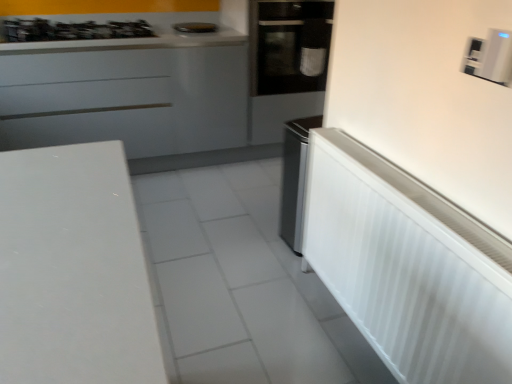
Question: Should I look upward or downward to see black glass oven at center?

Choices:
 (A) up
 (B) down

Answer: (A)

Question: Is metallic silver gas stove at upper left behind white plastic radiator at right, positioned as the 3th appliance in top-to-bottom order?

Choices:
 (A) yes
 (B) no

Answer: (A)

Question: Considering the relative positions of metallic silver gas stove at upper left and white plastic radiator at right, positioned as the 3th appliance in top-to-bottom order, in the image provided, is metallic silver gas stove at upper left to the left of white plastic radiator at right, positioned as the 3th appliance in top-to-bottom order, from the viewer's perspective?

Choices:
 (A) no
 (B) yes

Answer: (B)

Question: Would you say metallic silver gas stove at upper left is outside white plastic radiator at right, positioned as the 3th appliance in top-to-bottom order?

Choices:
 (A) yes
 (B) no

Answer: (A)

Question: Is metallic silver gas stove at upper left taller than white plastic radiator at right, which ranks as the 1th appliance in front-to-back order?

Choices:
 (A) yes
 (B) no

Answer: (B)

Question: Is metallic silver gas stove at upper left oriented away from white plastic radiator at right, the second appliance in the right-to-left sequence?

Choices:
 (A) no
 (B) yes

Answer: (A)

Question: Is metallic silver gas stove at upper left not close to white plastic radiator at right, which ranks as the 1th appliance in front-to-back order?

Choices:
 (A) no
 (B) yes

Answer: (B)

Question: Is white plastic radiator at right, the third appliance positioned from the back, touching metallic silver toaster at upper center, the 1th appliance from the left?

Choices:
 (A) yes
 (B) no

Answer: (B)

Question: Is white plastic radiator at right, the second appliance in the right-to-left sequence, shorter than metallic silver toaster at upper center, which is the third appliance in front-to-back order?

Choices:
 (A) no
 (B) yes

Answer: (A)

Question: From a real-world perspective, is white plastic radiator at right, the third appliance positioned from the back, located higher than metallic silver toaster at upper center, which is the 1th appliance from back to front?

Choices:
 (A) yes
 (B) no

Answer: (B)

Question: Considering the relative positions of white plastic radiator at right, the second appliance in the right-to-left sequence, and metallic silver toaster at upper center, arranged as the third appliance when ordered from the bottom, in the image provided, is white plastic radiator at right, the second appliance in the right-to-left sequence, to the left of metallic silver toaster at upper center, arranged as the third appliance when ordered from the bottom, from the viewer's perspective?

Choices:
 (A) no
 (B) yes

Answer: (A)

Question: From the image's perspective, is white plastic radiator at right, the second appliance in the right-to-left sequence, over metallic silver toaster at upper center, which is the third appliance in front-to-back order?

Choices:
 (A) yes
 (B) no

Answer: (B)

Question: Is white plastic radiator at right, positioned as the 3th appliance in top-to-bottom order, oriented away from metallic silver toaster at upper center, which is the third appliance in front-to-back order?

Choices:
 (A) no
 (B) yes

Answer: (A)

Question: From a real-world perspective, is white plastic radiator at right, the second appliance in the right-to-left sequence, on black glass oven at center?

Choices:
 (A) no
 (B) yes

Answer: (A)